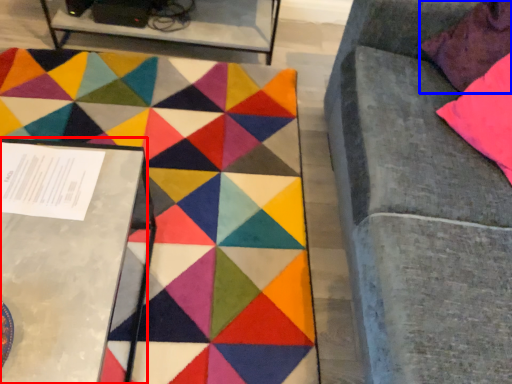
Question: Which object appears closest to the camera in this image, table (highlighted by a red box) or pillow (highlighted by a blue box)?

Choices:
 (A) table
 (B) pillow

Answer: (A)